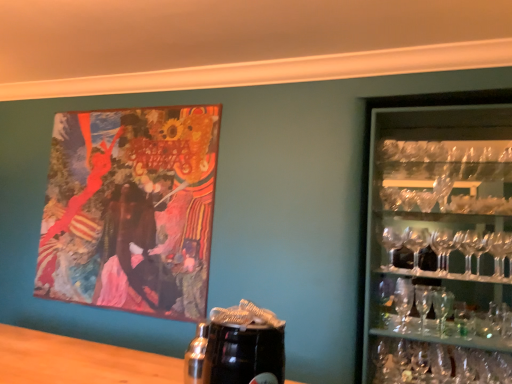
Question: Is point [x=55, y=200] positioned closer to the camera than point [x=440, y=329]?

Choices:
 (A) closer
 (B) farther

Answer: (B)

Question: From a real-world perspective, is oil painting at upper left physically located above or below clear glass martini glass at right?

Choices:
 (A) above
 (B) below

Answer: (A)

Question: Which object is positioned farthest from the clear glass martini glass at right?

Choices:
 (A) transparent glassware at right
 (B) oil painting at upper left

Answer: (B)

Question: Estimate the real-world distances between objects in this image. Which object is farther from the clear glass martini glass at right?

Choices:
 (A) transparent glassware at right
 (B) oil painting at upper left

Answer: (B)